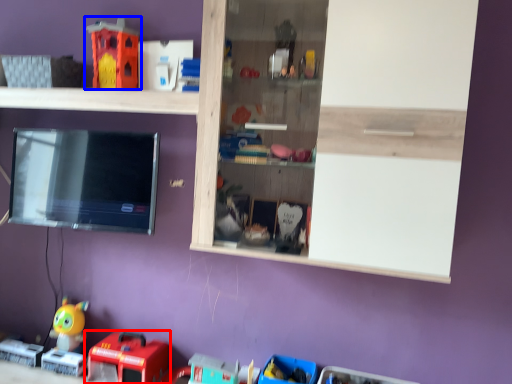
Question: Which of the following is the closest to the observer, toy (highlighted by a red box) or toy (highlighted by a blue box)?

Choices:
 (A) toy
 (B) toy

Answer: (A)